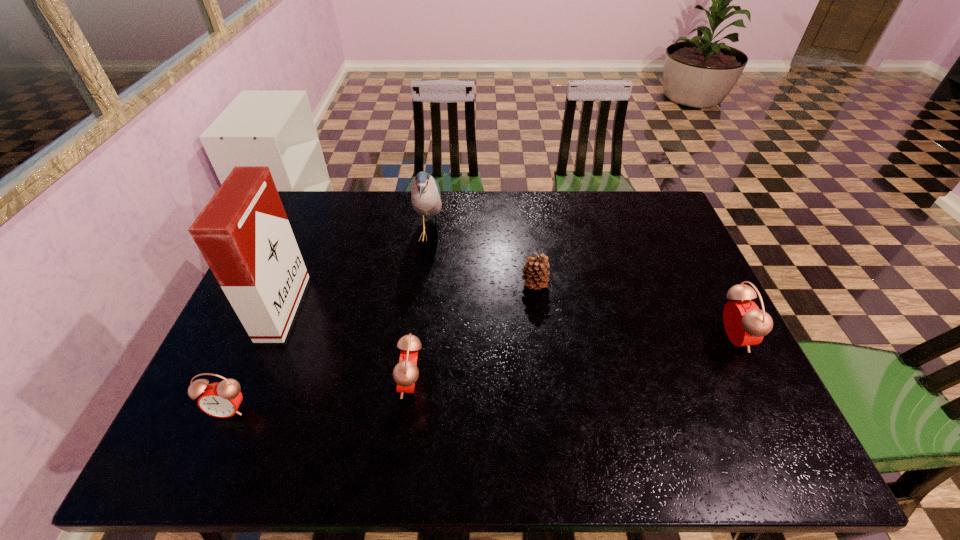
This screenshot has width=960, height=540. I want to click on free region located on the clock face of the second alarm clock from right to left, so click(295, 383).

This screenshot has width=960, height=540. What are the coordinates of `blank space located at the tip of the farthest object's beak` in the screenshot? It's located at (499, 234).

Find the location of a particular element. vacant space situated 0.350m on the front-facing side of the tallest object is located at coordinates (428, 307).

Locate an element on the screen. The image size is (960, 540). vacant space located on the right of the second object from right to left is located at coordinates (655, 285).

Locate an element on the screen. object that is at the far edge is located at coordinates (425, 196).

Where is `alarm clock that is at the left edge`? alarm clock that is at the left edge is located at coordinates 222,399.

Locate an element on the screen. cigarette_case at the left edge is located at coordinates (243, 233).

Locate an element on the screen. object that is positioned at the right edge is located at coordinates (745, 325).

Locate an element on the screen. This screenshot has width=960, height=540. object located at the near left corner is located at coordinates (222, 399).

Where is `free space at the far edge`? Image resolution: width=960 pixels, height=540 pixels. free space at the far edge is located at coordinates (511, 233).